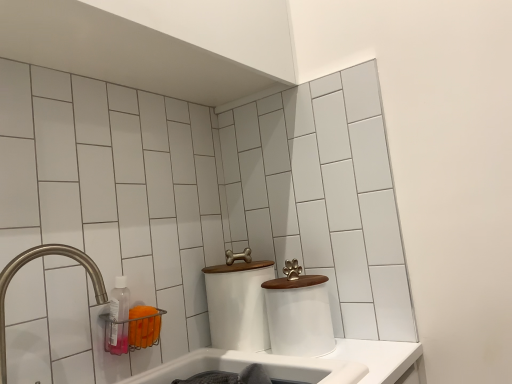
Question: Is white plastic bath at lower center far away from brushed metal faucet at left?

Choices:
 (A) yes
 (B) no

Answer: (B)

Question: From a real-world perspective, does white plastic bath at lower center sit lower than brushed metal faucet at left?

Choices:
 (A) no
 (B) yes

Answer: (B)

Question: Considering the relative positions of white plastic bath at lower center and brushed metal faucet at left in the image provided, is white plastic bath at lower center to the right of brushed metal faucet at left from the viewer's perspective?

Choices:
 (A) no
 (B) yes

Answer: (B)

Question: Is white plastic bath at lower center shorter than brushed metal faucet at left?

Choices:
 (A) no
 (B) yes

Answer: (B)

Question: Would you say brushed metal faucet at left is part of white plastic bath at lower center's contents?

Choices:
 (A) yes
 (B) no

Answer: (B)

Question: Would you say transparent plastic bottle at lower left is to the left or to the right of brushed metal faucet at left in the picture?

Choices:
 (A) right
 (B) left

Answer: (A)

Question: Which is correct: transparent plastic bottle at lower left is inside brushed metal faucet at left, or outside of it?

Choices:
 (A) inside
 (B) outside

Answer: (B)

Question: Considering the positions of transparent plastic bottle at lower left and brushed metal faucet at left in the image, is transparent plastic bottle at lower left bigger or smaller than brushed metal faucet at left?

Choices:
 (A) big
 (B) small

Answer: (B)

Question: Considering their positions, is transparent plastic bottle at lower left located in front of or behind brushed metal faucet at left?

Choices:
 (A) front
 (B) behind

Answer: (B)

Question: Considering the relative positions of transparent plastic bottle at lower left and white matte toilet paper at center, which is counted as the 2th toilet paper, starting from the left, in the image provided, is transparent plastic bottle at lower left to the left or to the right of white matte toilet paper at center, which is counted as the 2th toilet paper, starting from the left,?

Choices:
 (A) left
 (B) right

Answer: (A)

Question: From a real-world perspective, relative to white matte toilet paper at center, which is counted as the 2th toilet paper, starting from the left, is transparent plastic bottle at lower left vertically above or below?

Choices:
 (A) above
 (B) below

Answer: (A)

Question: From the image's perspective, is transparent plastic bottle at lower left above or below white matte toilet paper at center, the 1th toilet paper in the right-to-left sequence?

Choices:
 (A) below
 (B) above

Answer: (B)

Question: Relative to white matte toilet paper at center, the 1th toilet paper in the right-to-left sequence, is transparent plastic bottle at lower left in front or behind?

Choices:
 (A) behind
 (B) front

Answer: (B)

Question: Does point (302, 372) appear closer or farther from the camera than point (119, 286)?

Choices:
 (A) closer
 (B) farther

Answer: (A)

Question: From the image's perspective, relative to transparent plastic bottle at lower left, is white plastic bath at lower center above or below?

Choices:
 (A) above
 (B) below

Answer: (B)